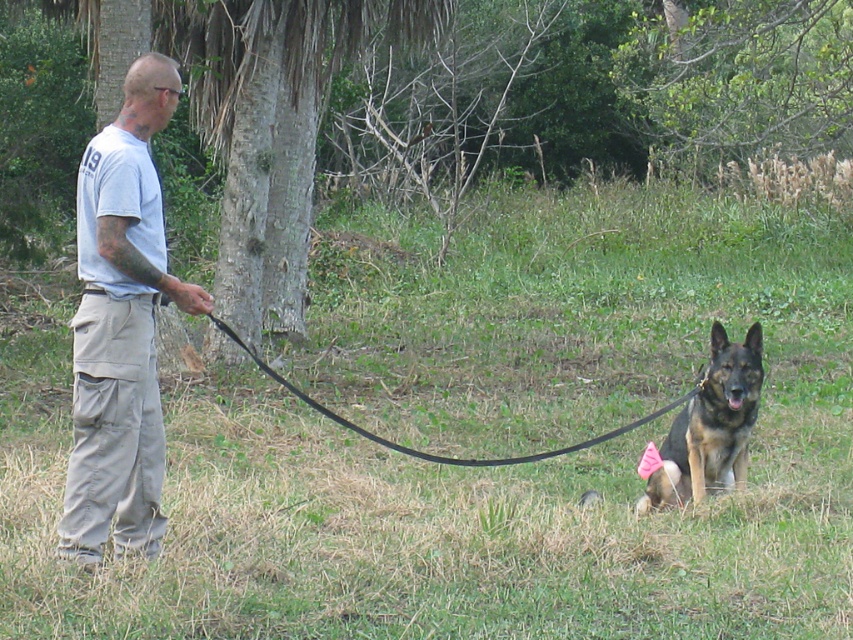
Which is in front, point (322, 595) or point (109, 269)?

Positioned in front is point (109, 269).

Does point (776, 368) come closer to viewer compared to point (144, 268)?

That is False.

Who is more distant from viewer, (x=700, y=515) or (x=91, y=353)?

The point (x=700, y=515) is more distant.

Where is `green grass at center`? green grass at center is located at coordinates (480, 445).

From the picture: Can you confirm if light gray cotton t-shirt at center is shorter than green leafy tree at upper center?

Incorrect, light gray cotton t-shirt at center's height does not fall short of green leafy tree at upper center's.

Is light gray cotton t-shirt at center below green leafy tree at upper center?

Yes, light gray cotton t-shirt at center is below green leafy tree at upper center.

Describe the element at coordinates (120, 326) in the screenshot. This screenshot has height=640, width=853. I see `light gray cotton t-shirt at center` at that location.

Identify the location of light gray cotton t-shirt at center. (120, 326).

Is green grass at center wider than black rubber leash at center?

Correct, the width of green grass at center exceeds that of black rubber leash at center.

Between green grass at center and black rubber leash at center, which one has less height?

black rubber leash at center is shorter.

The width and height of the screenshot is (853, 640). I want to click on green grass at center, so click(x=480, y=445).